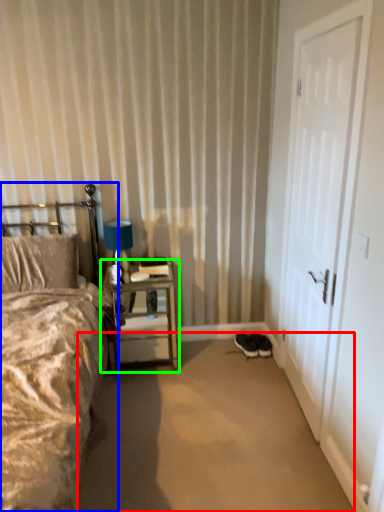
Question: Based on their relative distances, which object is nearer to plain (highlighted by a red box)? Choose from bed (highlighted by a blue box) and nightstand (highlighted by a green box).

Choices:
 (A) bed
 (B) nightstand

Answer: (B)